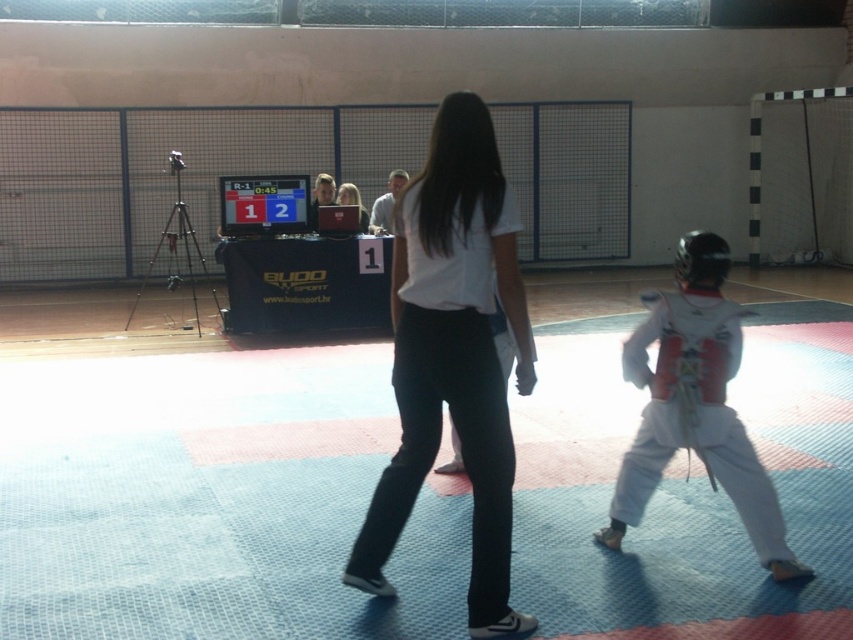
Question: Estimate the real-world distances between objects in this image. Which object is closer to the matte white laptop at center?

Choices:
 (A) white matte shirt at center
 (B) white karate uniform at right

Answer: (B)

Question: Which of the following is the farthest from the observer?

Choices:
 (A) matte white laptop at center
 (B) white matte shirt at center
 (C) white karate uniform at right

Answer: (A)

Question: Which of the following is the farthest from the observer?

Choices:
 (A) white matte shirt at center
 (B) white karate uniform at right
 (C) matte white laptop at center

Answer: (C)

Question: Does white karate uniform at right have a lesser width compared to matte white laptop at center?

Choices:
 (A) no
 (B) yes

Answer: (A)

Question: Does white matte shirt at center appear over matte white laptop at center?

Choices:
 (A) yes
 (B) no

Answer: (B)

Question: Where is white karate uniform at right located in relation to matte white laptop at center in the image?

Choices:
 (A) right
 (B) left

Answer: (A)